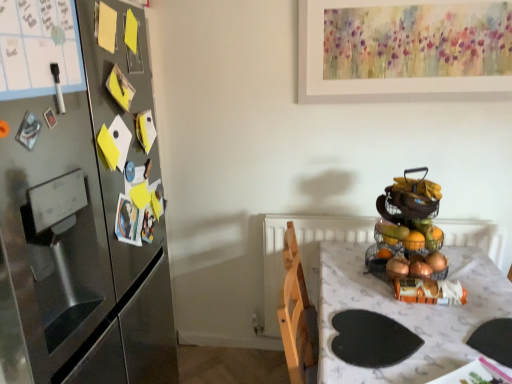
Question: From the image's perspective, is wire mesh fruit basket at right, the second basket from the bottom, located above or below stainless steel refrigerator at left?

Choices:
 (A) below
 (B) above

Answer: (B)

Question: Considering the positions of point (432, 233) and point (73, 319), is point (432, 233) closer or farther from the camera than point (73, 319)?

Choices:
 (A) farther
 (B) closer

Answer: (A)

Question: Estimate the real-world distances between objects in this image. Which object is closer to the white glossy table at center?

Choices:
 (A) stainless steel refrigerator at left
 (B) wire mesh fruit basket at right, the second basket from the bottom
 (C) wire mesh basket at right, the 2th basket when ordered from top to bottom

Answer: (C)

Question: Which is farther from the white glossy table at center?

Choices:
 (A) wire mesh basket at right, which appears as the first basket when ordered from the bottom
 (B) stainless steel refrigerator at left
 (C) wire mesh fruit basket at right, the second basket from the bottom

Answer: (B)